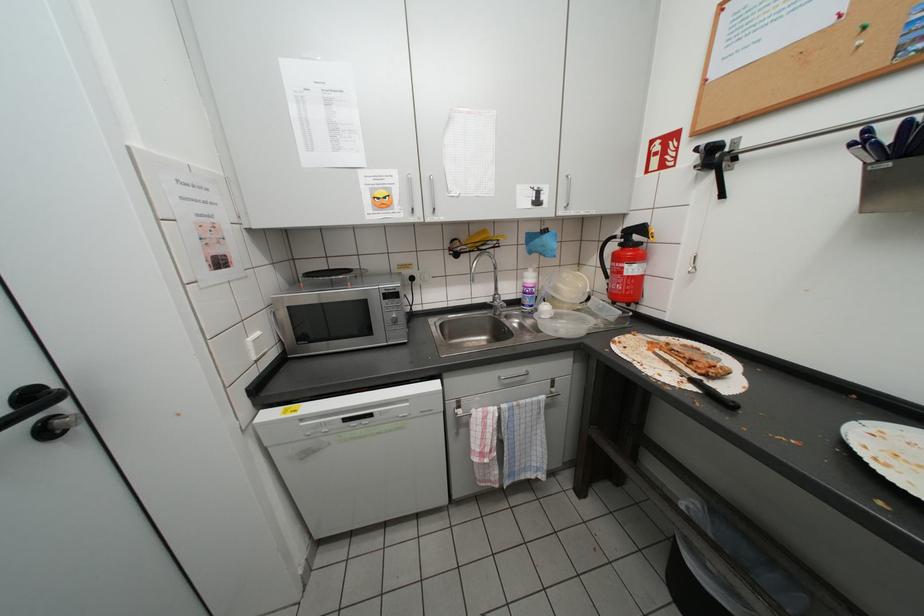
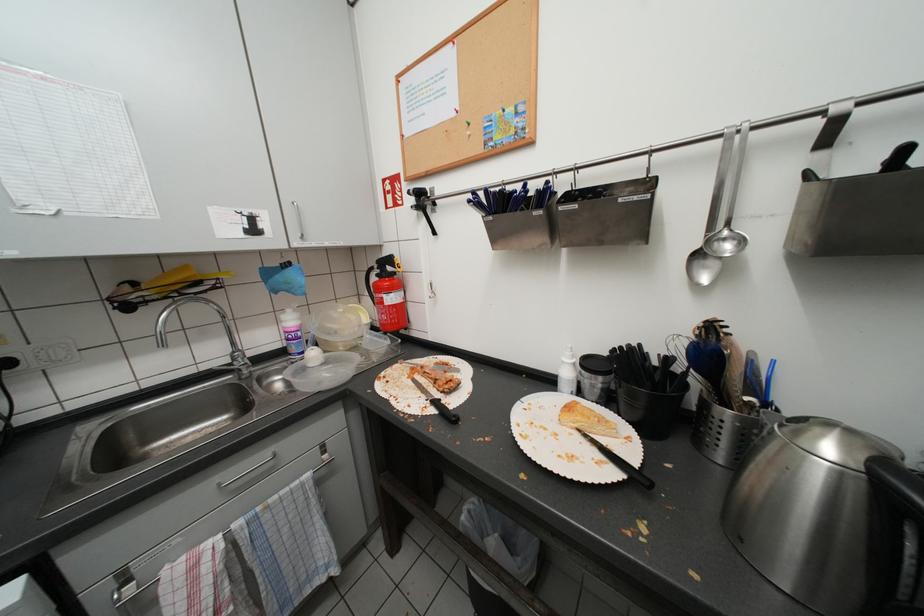
Question: The camera is either moving clockwise (left) or counter-clockwise (right) around the object. The first image is from the beginning of the video and the second image is from the end. Is the camera moving left or right when shooting the video?

Choices:
 (A) Left
 (B) Right

Answer: (A)